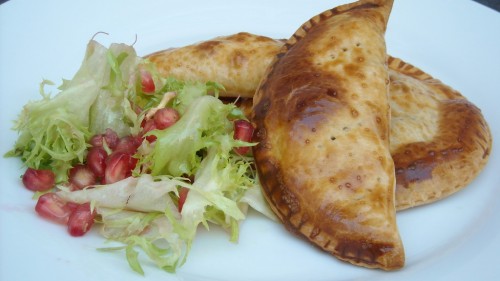
Where is `white plate`? white plate is located at coordinates (133, 14).